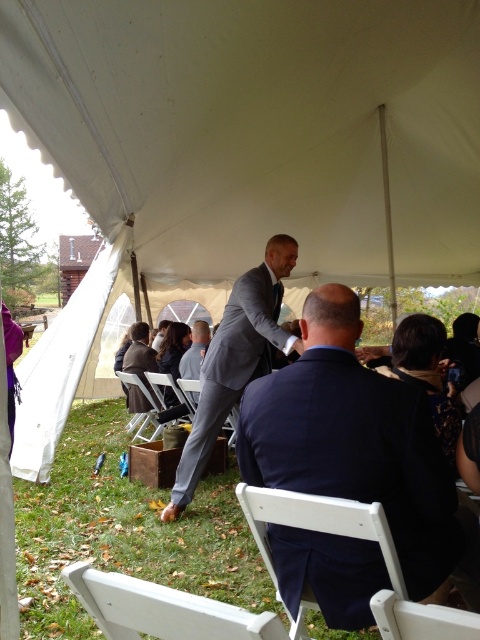
You are organizing a photo shoot and need to position the navy blue suit at center and the white plastic chair at lower right. Given their sizes, which object should you place first to ensure proper spacing?

The navy blue suit at center should be placed first since it is larger than the white plastic chair at lower right, ensuring sufficient space is allocated for it.

You are a photographer at the event and want to capture a photo of the navy blue suit at center without the metallic silver chair at lower center blocking the view. Is this possible based on their positions?

The navy blue suit at center is positioned over the metallic silver chair at lower center, meaning the chair is directly beneath the suit. Therefore, the metallic silver chair at lower center would block the view of the navy blue suit at center in a direct shot.